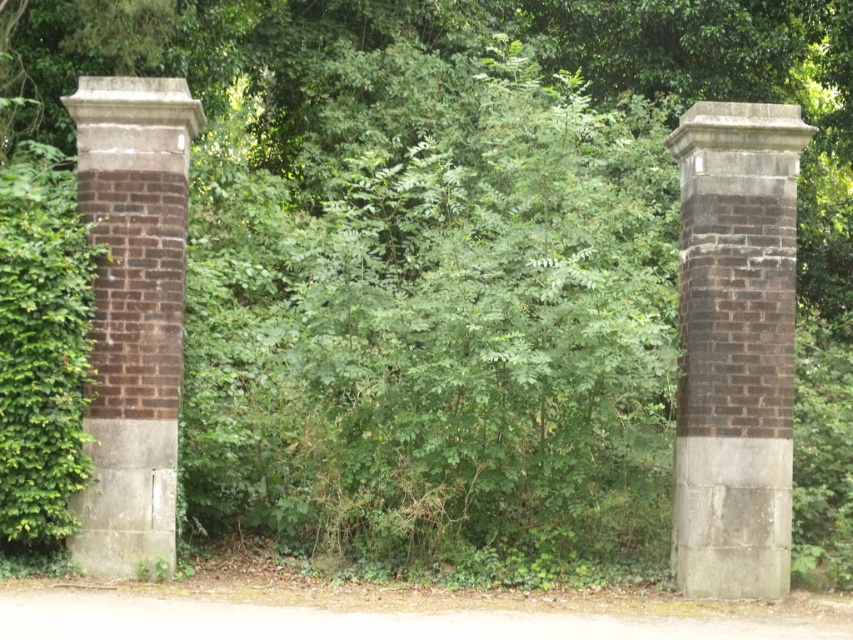
You are designing a pathway between the brown brick column at right and the brown brick pillar at left. If you want the pathway to be equally wide on both sides of the column and pillar, which side of the column or pillar should you adjust to ensure symmetry?

Since the brown brick column at right is wider than the brown brick pillar at left, you should adjust the pathway on the right side of the column to be narrower than the left side of the pillar to maintain symmetry.

You are a landscape architect designing a pathway between the brown brick column at right and the brown brick pillar at left. Which pillar should the pathway start closer to if you want it to appear balanced?

The pathway should start closer to the brown brick pillar at left because it is shorter than the brown brick column at right, creating a balanced visual weight.